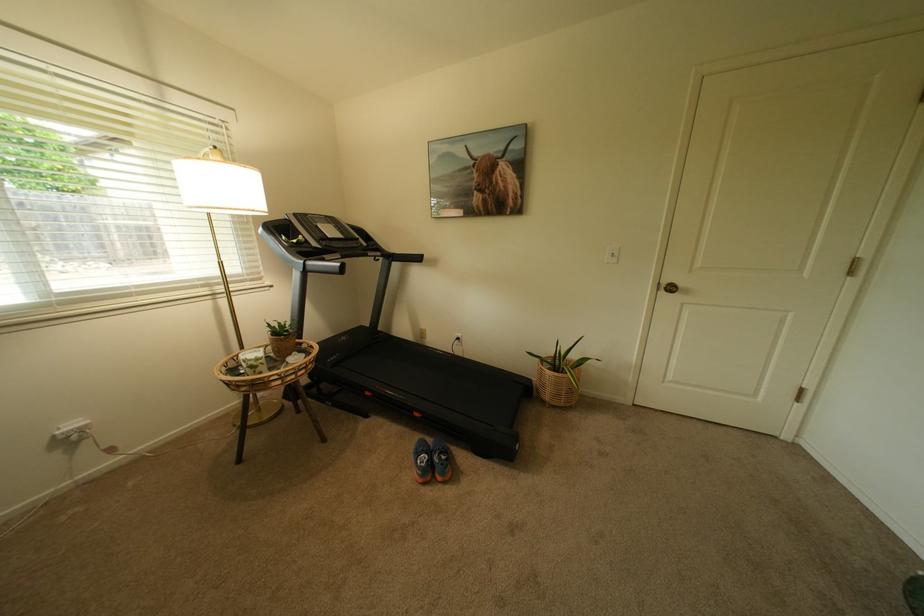
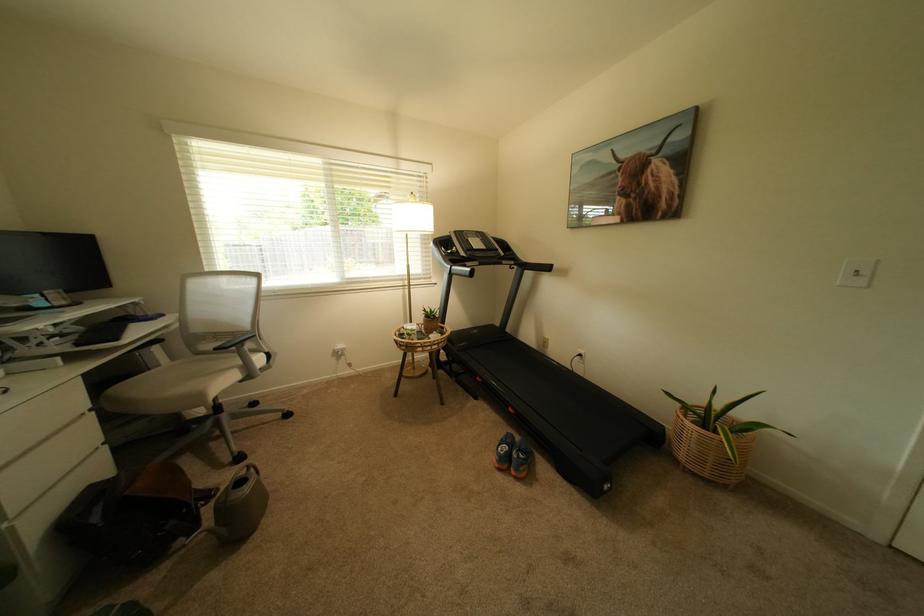
The point at (622, 254) is marked in the first image. Where is the corresponding point in the second image?

(866, 272)